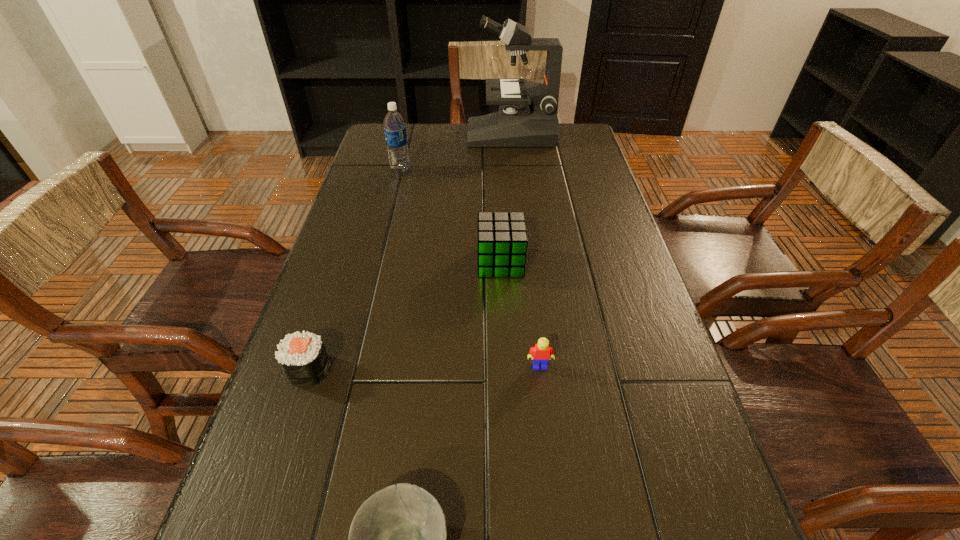
Locate which object ranks fifth in proximity to the second tallest object. Please provide its 2D coordinates. Your answer should be formatted as a tuple, i.e. [(x, y)], where the tuple contains the x and y coordinates of a point satisfying the conditions above.

[(397, 539)]

Where is `object that stands as the fifth closest to the sushi`? This screenshot has width=960, height=540. object that stands as the fifth closest to the sushi is located at coordinates (527, 116).

What are the coordinates of `free space that satisfies the following two spatial constraints: 1. on the front side of the second tallest object; 2. on the right side of the cube` in the screenshot? It's located at (378, 262).